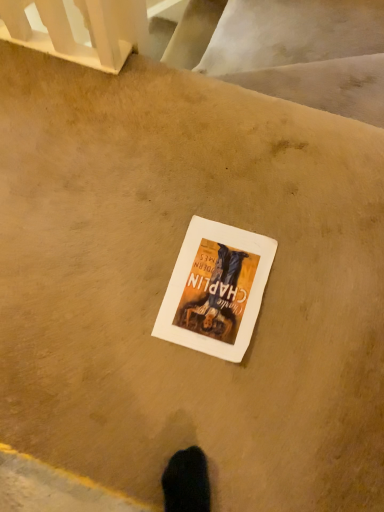
Find the location of `vacant space underneath white paper at center (from a real-world perspective)`. vacant space underneath white paper at center (from a real-world perspective) is located at coordinates (215, 286).